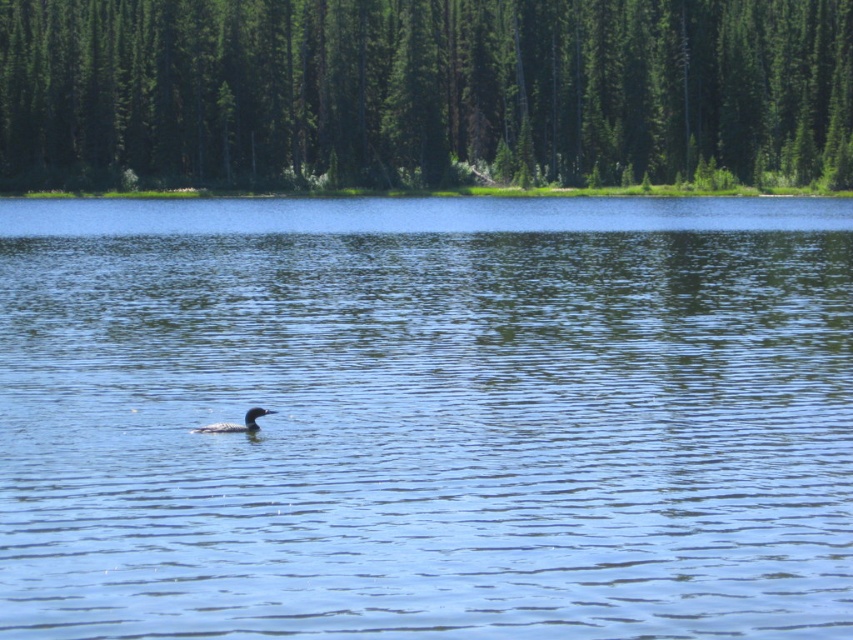
Does point (766, 112) come closer to viewer compared to point (252, 422)?

That is False.

Is green textured trees at upper center further to camera compared to dark gray matte duck at center?

That is True.

Who is more distant from viewer, (424, 36) or (244, 420)?

The point (424, 36) is behind.

Find the location of `green textured trees at upper center`. green textured trees at upper center is located at coordinates (421, 90).

Who is lower down, blue water at center or dark gray matte duck at center?

Positioned lower is dark gray matte duck at center.

Does blue water at center appear on the left side of dark gray matte duck at center?

Yes, blue water at center is to the left of dark gray matte duck at center.

From the picture: Who is more forward, (78, 604) or (245, 413)?

Positioned in front is point (78, 604).

Locate an element on the screen. The image size is (853, 640). blue water at center is located at coordinates (426, 417).

Between blue water at center and green textured trees at upper center, which one is positioned higher?

green textured trees at upper center is above.

Can you confirm if blue water at center is thinner than green textured trees at upper center?

Yes, blue water at center is thinner than green textured trees at upper center.

What do you see at coordinates (426, 417) in the screenshot? I see `blue water at center` at bounding box center [426, 417].

Identify the location of blue water at center. The width and height of the screenshot is (853, 640). (426, 417).